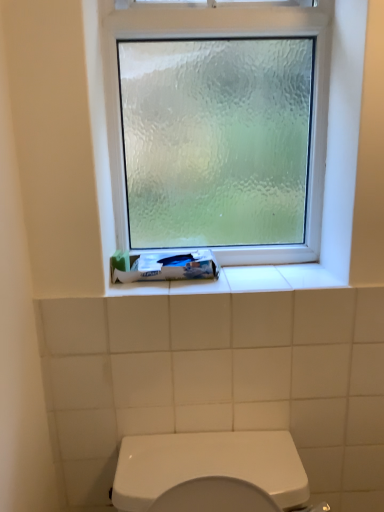
The image size is (384, 512). Describe the element at coordinates (225, 36) in the screenshot. I see `frosted glass window at upper center` at that location.

In order to face frosted glass window at upper center, should I rotate leftwards or rightwards?

You should rotate right by 3.123 degrees.

This screenshot has height=512, width=384. What are the coordinates of `frosted glass window at upper center` in the screenshot? It's located at (225, 36).

Locate an element on the screen. white matte tube at lower center is located at coordinates (165, 267).

Describe the element at coordinates (165, 267) in the screenshot. I see `white matte tube at lower center` at that location.

Where is `frosted glass window at upper center`? frosted glass window at upper center is located at coordinates (225, 36).

Is white matte tube at lower center to the left of frosted glass window at upper center from the viewer's perspective?

Correct, you'll find white matte tube at lower center to the left of frosted glass window at upper center.

Which object is closer to the camera, white matte tube at lower center or frosted glass window at upper center?

frosted glass window at upper center is more forward.

Is point (125, 264) more distant than point (235, 28)?

Yes, point (125, 264) is farther from viewer.

From the image's perspective, is white matte tube at lower center beneath frosted glass window at upper center?

Indeed, from the image's perspective, white matte tube at lower center is shown beneath frosted glass window at upper center.

From a real-world perspective, between white matte tube at lower center and frosted glass window at upper center, who is vertically lower?

In real-world perspective, white matte tube at lower center is lower.

Considering the sizes of white matte tube at lower center and frosted glass window at upper center in the image, is white matte tube at lower center wider or thinner than frosted glass window at upper center?

In the image, white matte tube at lower center appears to be wider than frosted glass window at upper center.

Consider the image. Does white matte tube at lower center have a greater height compared to frosted glass window at upper center?

No, white matte tube at lower center is not taller than frosted glass window at upper center.

Consider the image. Between white matte tube at lower center and frosted glass window at upper center, which one has larger size?

With larger size is frosted glass window at upper center.

Looking at this image, would you say white matte tube at lower center is inside or outside frosted glass window at upper center?

white matte tube at lower center exists outside the volume of frosted glass window at upper center.

Would you say white matte tube at lower center is a long distance from frosted glass window at upper center?

No, white matte tube at lower center is in close proximity to frosted glass window at upper center.

Could you tell me if white matte tube at lower center is turned towards frosted glass window at upper center?

No, white matte tube at lower center is not oriented towards frosted glass window at upper center.

How many degrees apart are the facing directions of white matte tube at lower center and frosted glass window at upper center?

white matte tube at lower center and frosted glass window at upper center are facing 1.18 degrees away from each other.

How far apart are white matte tube at lower center and frosted glass window at upper center?

white matte tube at lower center and frosted glass window at upper center are 11.05 inches apart.

This screenshot has height=512, width=384. Identify the location of window lying on the right of white matte tube at lower center. (225, 36).

Is frosted glass window at upper center to the right of white matte tube at lower center from the viewer's perspective?

Yes.

Is frosted glass window at upper center positioned in front of white matte tube at lower center?

That is True.

Is point (315, 60) positioned after point (187, 263)?

That is False.

In the scene shown: From the image's perspective, which is below, frosted glass window at upper center or white matte tube at lower center?

white matte tube at lower center appears lower in the image.

From a real-world perspective, which object stands above the other?

In real-world perspective, frosted glass window at upper center is above.

Considering the sizes of objects frosted glass window at upper center and white matte tube at lower center in the image provided, who is wider, frosted glass window at upper center or white matte tube at lower center?

With larger width is white matte tube at lower center.

In terms of height, does frosted glass window at upper center look taller or shorter compared to white matte tube at lower center?

Considering their sizes, frosted glass window at upper center has more height than white matte tube at lower center.

Does frosted glass window at upper center have a smaller size compared to white matte tube at lower center?

Result: No, frosted glass window at upper center is not smaller than white matte tube at lower center.

Would you say frosted glass window at upper center is outside white matte tube at lower center?

Yes, frosted glass window at upper center is not within white matte tube at lower center.

Is frosted glass window at upper center far away from white matte tube at lower center?

That's not correct — frosted glass window at upper center is a little close to white matte tube at lower center.

Is frosted glass window at upper center oriented towards white matte tube at lower center?

Yes.

Consider the image. Can you tell me how much frosted glass window at upper center and white matte tube at lower center differ in facing direction?

The angular difference between frosted glass window at upper center and white matte tube at lower center is 1.18 degrees.

At what (x,y) coordinates should I click in order to perform the action: click on toothpaste located underneath the frosted glass window at upper center (from a real-world perspective). Please return your answer as a coordinate pair (x, y). Looking at the image, I should click on (165, 267).

Where is `window on the right of white matte tube at lower center`? This screenshot has width=384, height=512. window on the right of white matte tube at lower center is located at coordinates (225, 36).

Where is `toothpaste below the frosted glass window at upper center (from the image's perspective)`? This screenshot has height=512, width=384. toothpaste below the frosted glass window at upper center (from the image's perspective) is located at coordinates (165, 267).